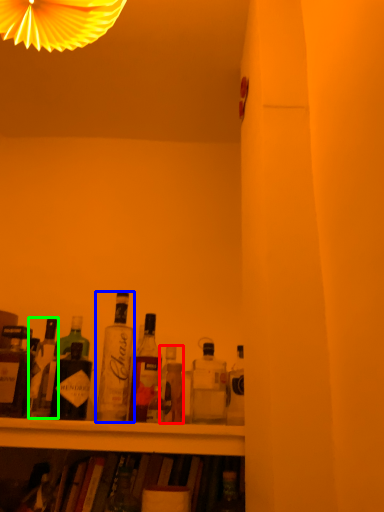
Question: Which is farther away from bottle (highlighted by a red box)? bottle (highlighted by a blue box) or bottle (highlighted by a green box)?

Choices:
 (A) bottle
 (B) bottle

Answer: (B)